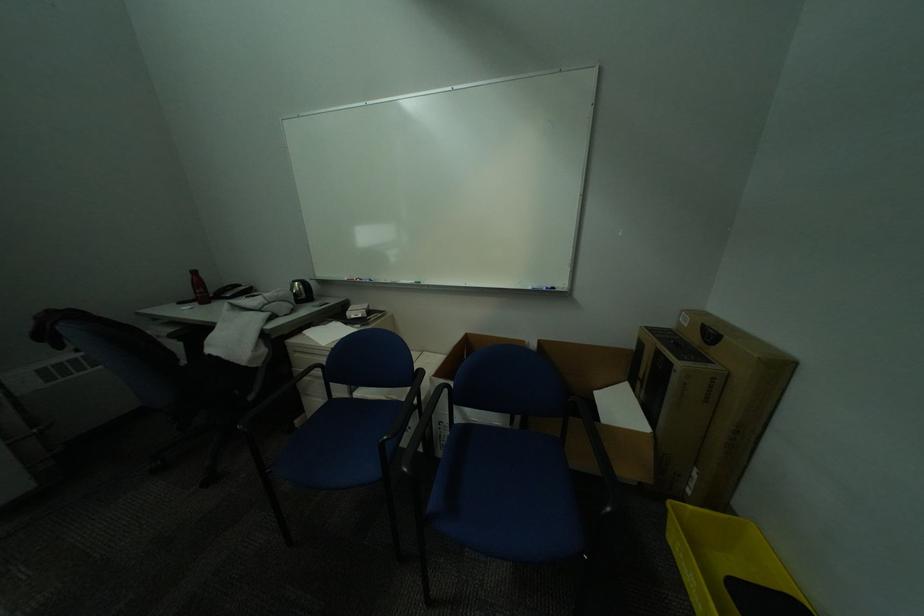
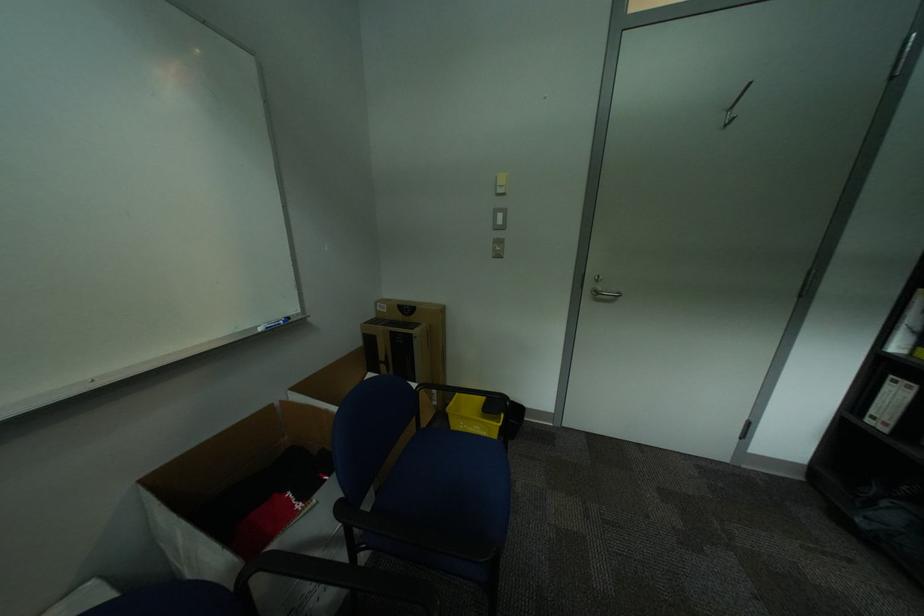
In the second image, find the point that corresponds to the point at 701,508 in the first image.

(463, 405)